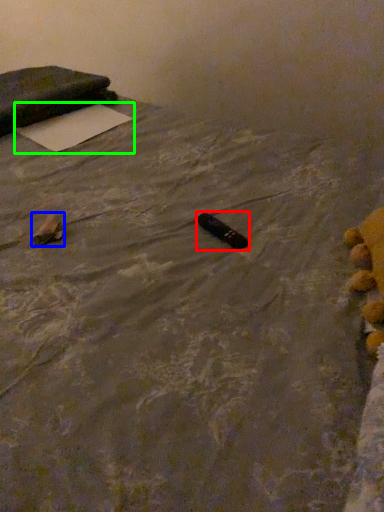
Question: Which object is positioned farthest from waste (highlighted by a red box)? Select from waste (highlighted by a blue box) and yoga mat (highlighted by a green box).

Choices:
 (A) waste
 (B) yoga mat

Answer: (B)